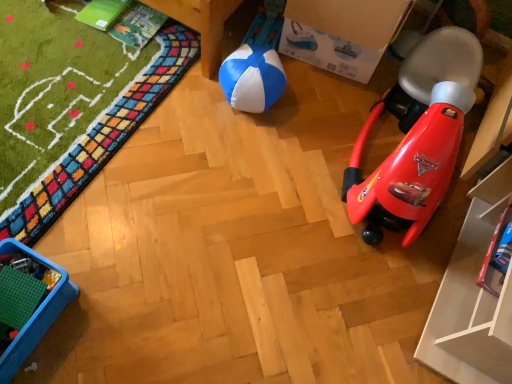
Question: Is cardboard box at upper center wider than metallic blue toy car at lower right, the second toy from the top?

Choices:
 (A) yes
 (B) no

Answer: (A)

Question: From a real-world perspective, is cardboard box at upper center located beneath metallic blue toy car at lower right, which is counted as the 1th toy, starting from the bottom?

Choices:
 (A) no
 (B) yes

Answer: (A)

Question: Is metallic blue toy car at lower right, which is counted as the 1th toy, starting from the bottom, a part of cardboard box at upper center?

Choices:
 (A) yes
 (B) no

Answer: (B)

Question: Are cardboard box at upper center and metallic blue toy car at lower right, which is counted as the 1th toy, starting from the bottom, far apart?

Choices:
 (A) no
 (B) yes

Answer: (A)

Question: Is cardboard box at upper center shorter than metallic blue toy car at lower right, which is counted as the 1th toy, starting from the bottom?

Choices:
 (A) no
 (B) yes

Answer: (A)

Question: From the image's perspective, is cardboard box at upper center located beneath metallic blue toy car at lower right, the second toy from the top?

Choices:
 (A) no
 (B) yes

Answer: (A)

Question: Considering the relative positions of blue plastic tray at lower left and blue/white fabric ball at center in the image provided, is blue plastic tray at lower left in front of blue/white fabric ball at center?

Choices:
 (A) yes
 (B) no

Answer: (A)

Question: Is the depth of blue plastic tray at lower left greater than that of blue/white fabric ball at center?

Choices:
 (A) no
 (B) yes

Answer: (A)

Question: Is blue plastic tray at lower left completely or partially outside of blue/white fabric ball at center?

Choices:
 (A) no
 (B) yes

Answer: (B)

Question: From a real-world perspective, does blue plastic tray at lower left stand above blue/white fabric ball at center?

Choices:
 (A) yes
 (B) no

Answer: (B)

Question: Does blue plastic tray at lower left appear on the right side of blue/white fabric ball at center?

Choices:
 (A) no
 (B) yes

Answer: (A)

Question: Is blue plastic tray at lower left not near blue/white fabric ball at center?

Choices:
 (A) no
 (B) yes

Answer: (A)

Question: Would you consider blue/white fabric ball at center to be distant from red plastic rocket at right, positioned as the 1th toy in top-to-bottom order?

Choices:
 (A) yes
 (B) no

Answer: (B)